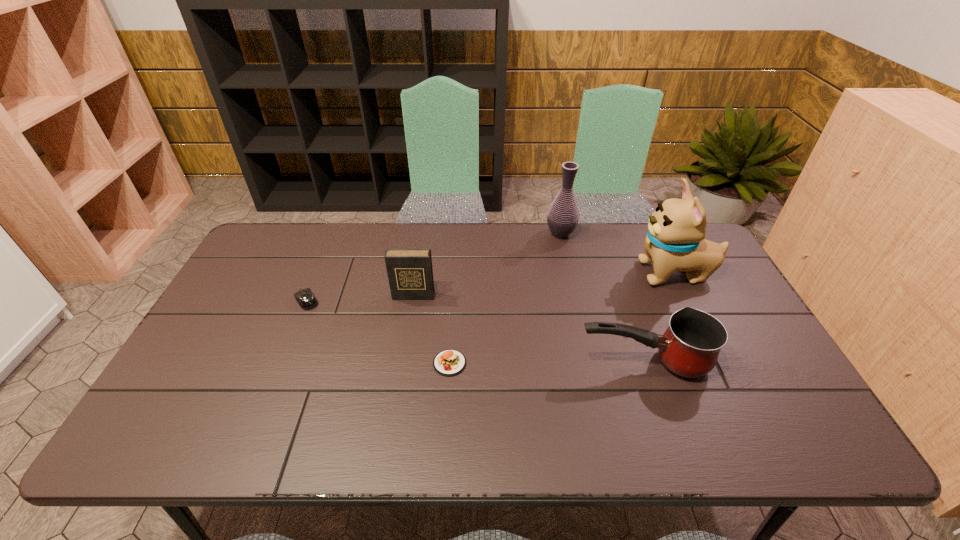
This screenshot has width=960, height=540. Identify the location of vacant point located between the second object from left to right and the second tallest object. (487, 265).

At what (x,y) coordinates should I click in order to perform the action: click on free space between the fifth tallest object and the diary. Please return your answer as a coordinate pair (x, y). Looking at the image, I should click on (360, 298).

Image resolution: width=960 pixels, height=540 pixels. I want to click on free space between the shortest object and the mouse, so click(x=378, y=332).

Where is `empty space that is in between the third object from left to right and the fifth object from right to left`? empty space that is in between the third object from left to right and the fifth object from right to left is located at coordinates (431, 329).

The image size is (960, 540). In order to click on vacant space in between the puppy and the vase in this screenshot , I will do `click(618, 254)`.

You are a GUI agent. You are given a task and a screenshot of the screen. Output one action in this format:
    pyautogui.click(x=<x>, y=<y>)
    Task: Click on the vacant region between the farthest object and the saucepan
    
    Given the screenshot: What is the action you would take?
    pyautogui.click(x=602, y=298)

This screenshot has height=540, width=960. Find the location of `vacant area between the diary and the farthest object`. vacant area between the diary and the farthest object is located at coordinates (487, 265).

Identify which object is the third nearest to the leftmost object. Please provide its 2D coordinates. Your answer should be formatted as a tuple, i.e. [(x, y)], where the tuple contains the x and y coordinates of a point satisfying the conditions above.

[(690, 346)]

Where is `object that can be found as the second closest to the patty (food)`? This screenshot has width=960, height=540. object that can be found as the second closest to the patty (food) is located at coordinates (690, 346).